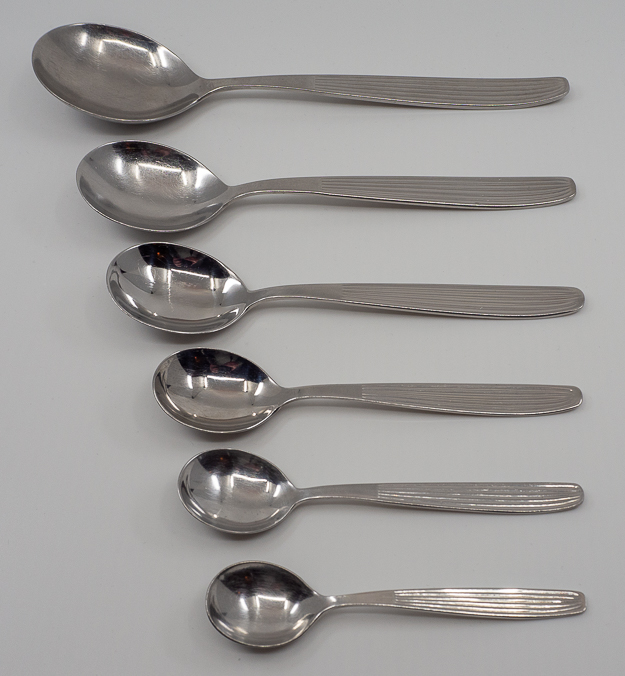
The width and height of the screenshot is (625, 676). Find the location of `spoons`. spoons is located at coordinates (260, 637), (247, 498), (229, 407), (176, 304), (152, 185), (112, 80).